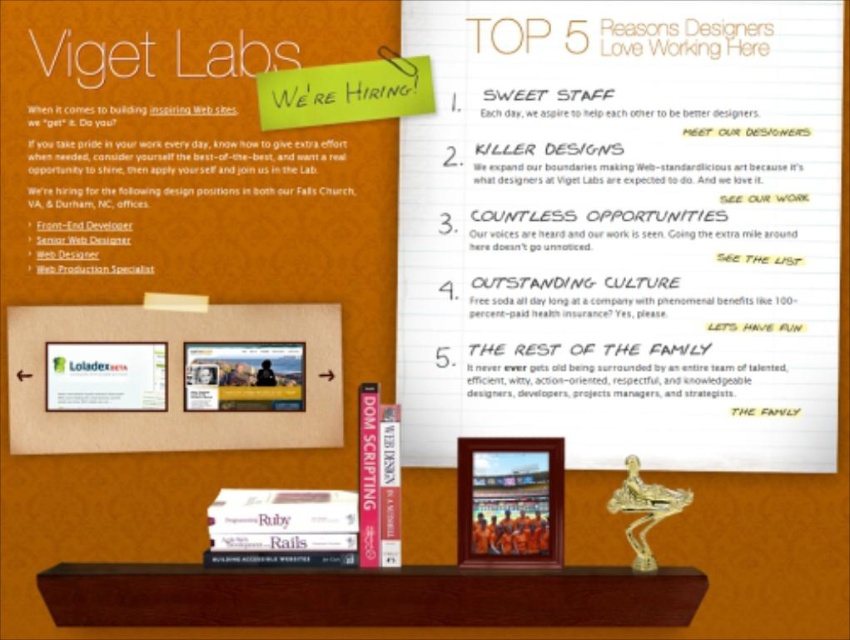
Looking at this image, which is below, white paper flyer at upper center or matte plastic flyer at center?

matte plastic flyer at center

Is point (748, 337) behind point (88, 342)?

Yes, it is behind point (88, 342).

Where is `white paper flyer at upper center`? white paper flyer at upper center is located at coordinates (622, 230).